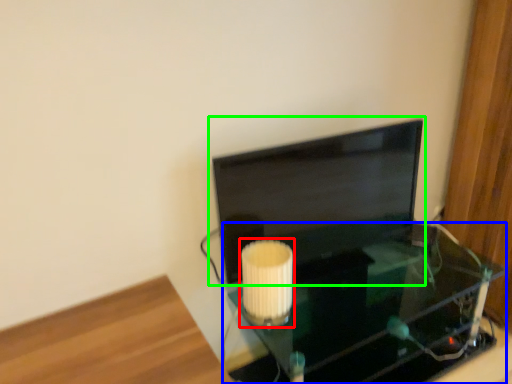
Question: Estimate the real-world distances between objects in this image. Which object is farther from lamp (highlighted by a red box), table (highlighted by a blue box) or computer monitor (highlighted by a green box)?

Choices:
 (A) table
 (B) computer monitor

Answer: (A)